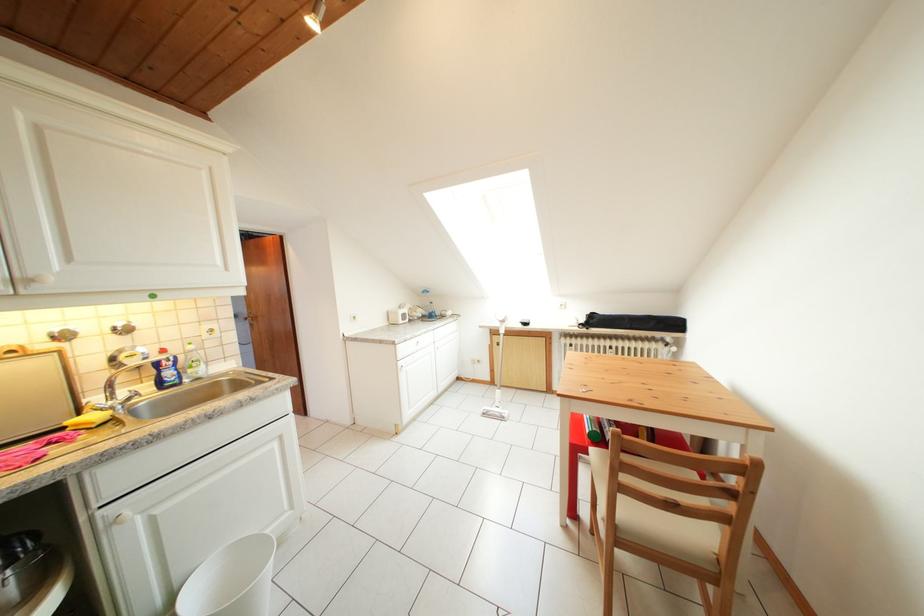
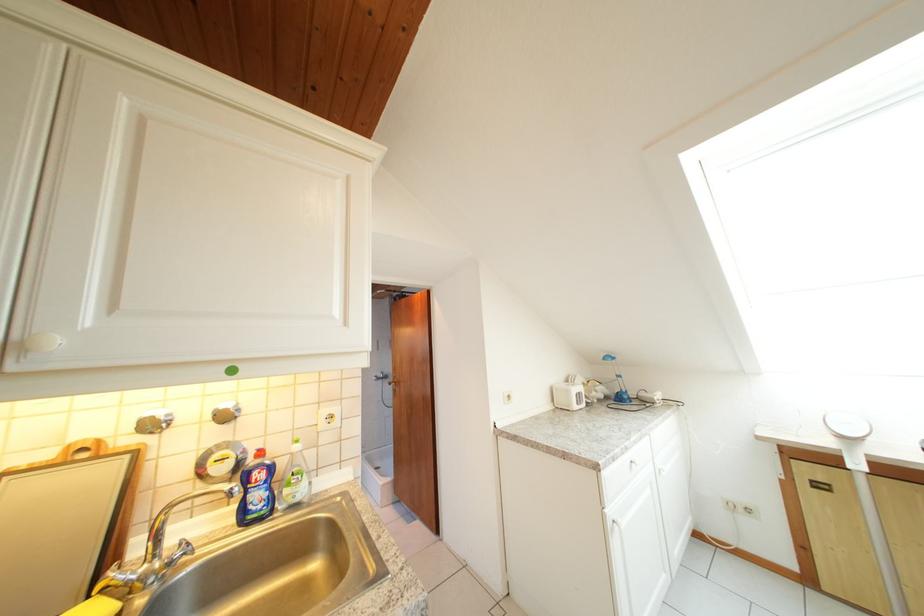
Question: The camera is either moving clockwise (left) or counter-clockwise (right) around the object. The first image is from the beginning of the video and the second image is from the end. Is the camera moving left or right when shooting the video?

Choices:
 (A) Left
 (B) Right

Answer: (B)